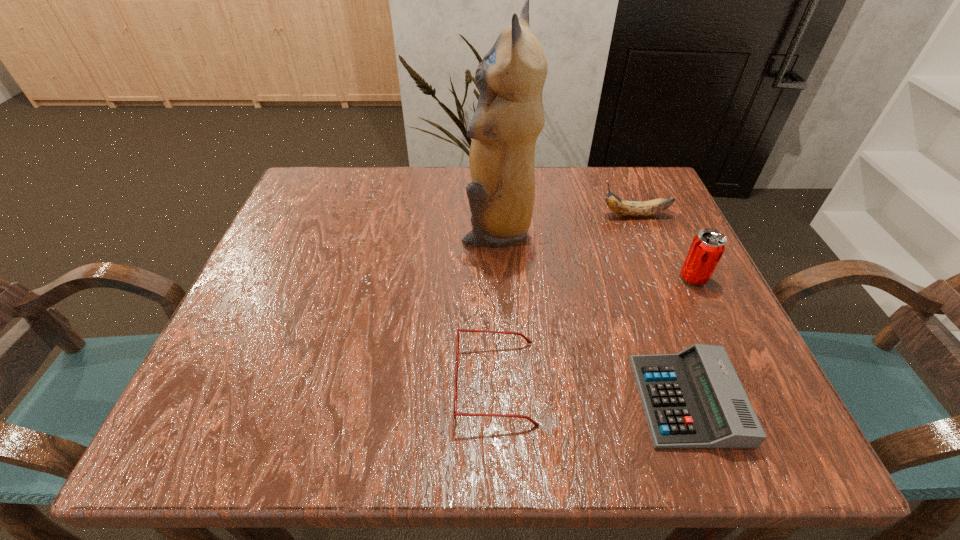
At what (x,y) coordinates should I click in order to perform the action: click on free space located at the stem of the banana. Please return your answer as a coordinate pair (x, y). Image resolution: width=960 pixels, height=540 pixels. Looking at the image, I should click on (529, 215).

Locate an element on the screen. The width and height of the screenshot is (960, 540). free space located at the stem of the banana is located at coordinates click(x=538, y=215).

Where is `vacant area situated 0.250m at the stem of the banana`? The width and height of the screenshot is (960, 540). vacant area situated 0.250m at the stem of the banana is located at coordinates (489, 215).

The height and width of the screenshot is (540, 960). What are the coordinates of `free location located 0.200m on the face of the second shortest object` in the screenshot? It's located at click(328, 383).

You are a GUI agent. You are given a task and a screenshot of the screen. Output one action in this format:
    pyautogui.click(x=<x>, y=<y>)
    Task: Click on the vacant space located on the face of the second shortest object
    
    Given the screenshot: What is the action you would take?
    pyautogui.click(x=316, y=383)

Image resolution: width=960 pixels, height=540 pixels. In order to click on vacant area located 0.120m on the face of the second shortest object in this screenshot , I will do point(380,383).

At what (x,y) coordinates should I click in order to perform the action: click on vacant space located on the back of the calculator. Please return your answer as a coordinate pair (x, y). The width and height of the screenshot is (960, 540). Looking at the image, I should click on (621, 220).

The width and height of the screenshot is (960, 540). In order to click on cat at the far edge in this screenshot , I will do `click(509, 116)`.

Where is `banana that is at the far edge`? This screenshot has height=540, width=960. banana that is at the far edge is located at coordinates (627, 208).

The width and height of the screenshot is (960, 540). In order to click on spectacles located in the near edge section of the desktop in this screenshot , I will do point(456,414).